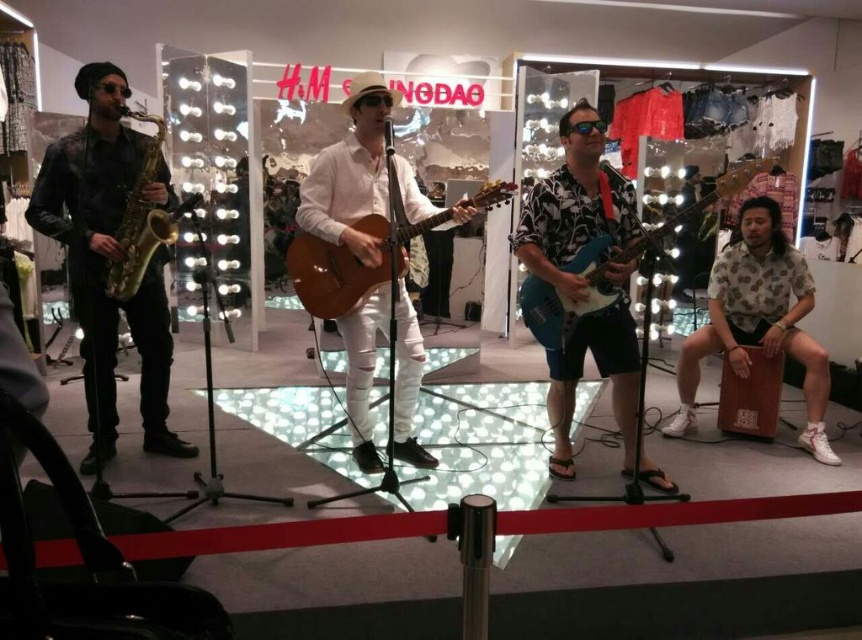
Between point (122, 144) and point (597, 276), which one is positioned behind?

The point (122, 144) is more distant.

Is point (109, 406) closer to camera compared to point (592, 282)?

No, (109, 406) is behind (592, 282).

What do you see at coordinates (105, 260) in the screenshot? The width and height of the screenshot is (862, 640). I see `shiny gold saxophone at left` at bounding box center [105, 260].

This screenshot has width=862, height=640. What are the coordinates of `shiny gold saxophone at left` in the screenshot? It's located at (105, 260).

Which is above, shiny gold saxophone at left or brown wood cajon at right?

shiny gold saxophone at left

Does shiny gold saxophone at left have a lesser height compared to brown wood cajon at right?

No, shiny gold saxophone at left is not shorter than brown wood cajon at right.

Where is `shiny gold saxophone at left`? The width and height of the screenshot is (862, 640). shiny gold saxophone at left is located at coordinates (105, 260).

Locate an element on the screen. Image resolution: width=862 pixels, height=640 pixels. shiny gold saxophone at left is located at coordinates (105, 260).

Is brown wood cajon at right smaller than matte brown acoustic guitar at center?

No.

Is brown wood cajon at right to the left of matte brown acoustic guitar at center from the viewer's perspective?

Incorrect, brown wood cajon at right is not on the left side of matte brown acoustic guitar at center.

Find the location of a particular element. brown wood cajon at right is located at coordinates (759, 320).